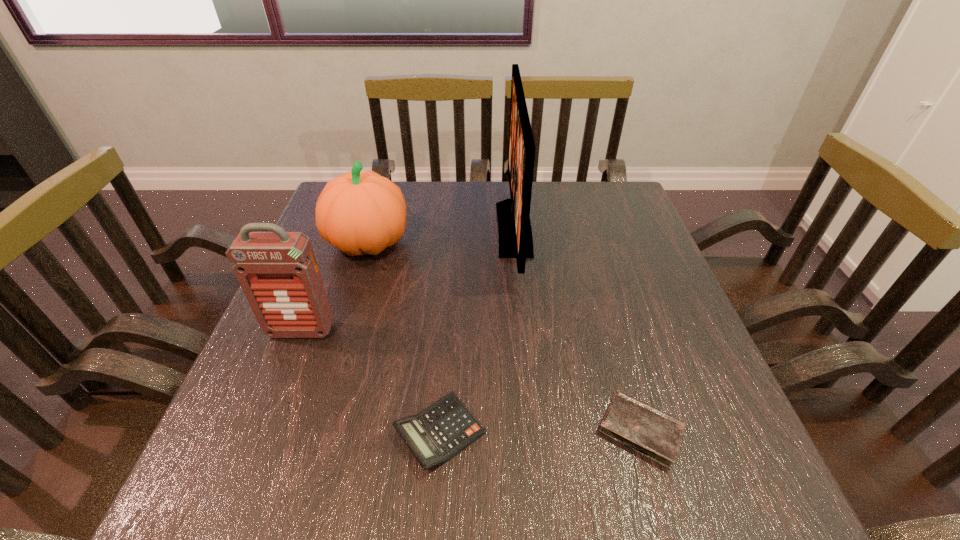
Where is `vacant space situated on the front-facing side of the monitor`? This screenshot has width=960, height=540. vacant space situated on the front-facing side of the monitor is located at coordinates (359, 229).

Where is `free region located 0.390m on the front-facing side of the monitor`? free region located 0.390m on the front-facing side of the monitor is located at coordinates (351, 229).

Where is `vacant region located 0.140m on the front-facing side of the second tallest object`? This screenshot has width=960, height=540. vacant region located 0.140m on the front-facing side of the second tallest object is located at coordinates (274, 400).

Image resolution: width=960 pixels, height=540 pixels. I want to click on free space located 0.170m on the back of the third shortest object, so click(385, 186).

At what (x,y) coordinates should I click in order to perform the action: click on vacant space situated on the back of the third object from right to left. Please return your answer as a coordinate pair (x, y). This screenshot has width=960, height=540. Looking at the image, I should click on (452, 260).

The width and height of the screenshot is (960, 540). I want to click on free space located 0.090m on the back of the shortest object, so click(x=619, y=356).

Where is `monitor that is at the far edge`? This screenshot has height=540, width=960. monitor that is at the far edge is located at coordinates (514, 227).

Image resolution: width=960 pixels, height=540 pixels. I want to click on pumpkin at the far edge, so pyautogui.click(x=359, y=213).

The image size is (960, 540). In order to click on calculator that is at the near edge in this screenshot , I will do `click(435, 435)`.

Image resolution: width=960 pixels, height=540 pixels. What are the coordinates of `diary present at the near edge` in the screenshot? It's located at (651, 432).